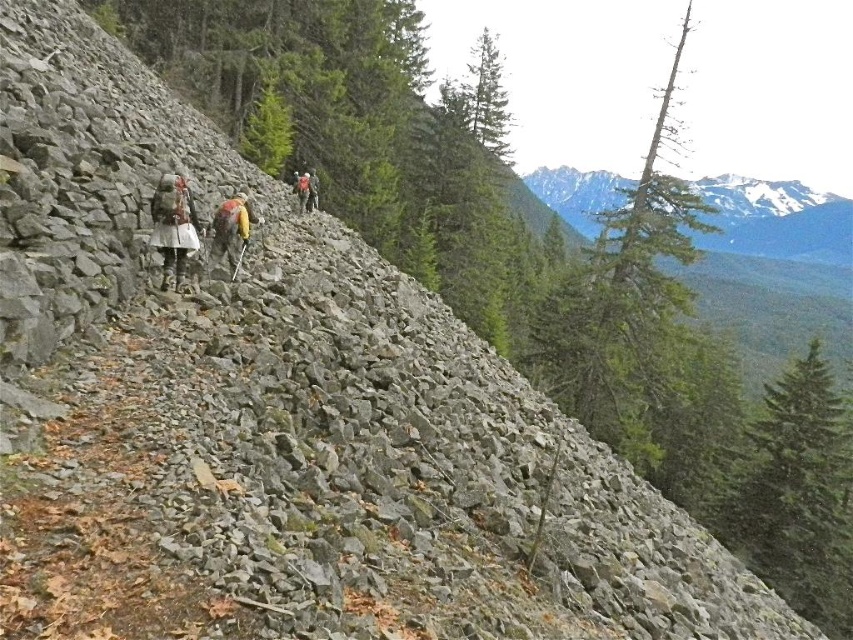
Question: Is snowy granite mountain at upper right wider than green matte tree at center?

Choices:
 (A) no
 (B) yes

Answer: (B)

Question: Which point is closer to the camera taking this photo?

Choices:
 (A) (483, 125)
 (B) (786, 237)
 (C) (280, 102)

Answer: (C)

Question: Which point appears closest to the camera in this image?

Choices:
 (A) (810, 236)
 (B) (273, 164)
 (C) (485, 84)
 (D) (306, 202)

Answer: (D)

Question: Can you confirm if green textured tree at upper center is thinner than camouflage fabric backpack at center?

Choices:
 (A) yes
 (B) no

Answer: (B)

Question: Which of the following is the closest to the observer?

Choices:
 (A) (813, 196)
 (B) (223, 244)

Answer: (B)

Question: Does green textured tree at upper center lie behind green textured pine tree at upper center?

Choices:
 (A) yes
 (B) no

Answer: (B)